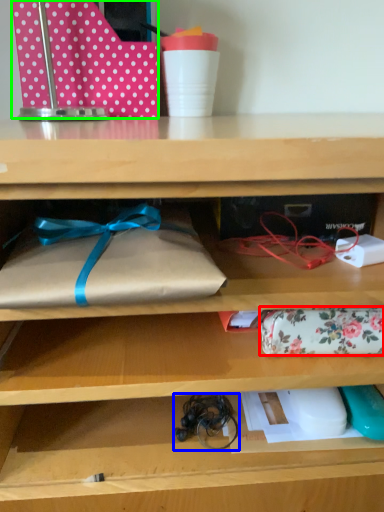
Question: Which object is positioned farthest from wrap (highlighted by a red box)? Select from twine (highlighted by a blue box) and wrapping paper (highlighted by a green box).

Choices:
 (A) twine
 (B) wrapping paper

Answer: (B)